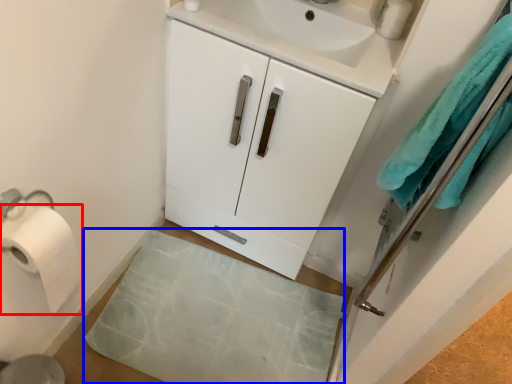
Question: Among these objects, which one is farthest to the camera, toilet paper (highlighted by a red box) or bath mat (highlighted by a blue box)?

Choices:
 (A) toilet paper
 (B) bath mat

Answer: (B)